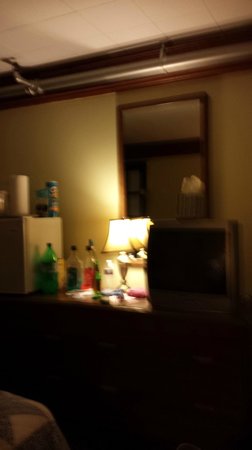
The width and height of the screenshot is (252, 450). I want to click on lamp, so click(x=121, y=239).